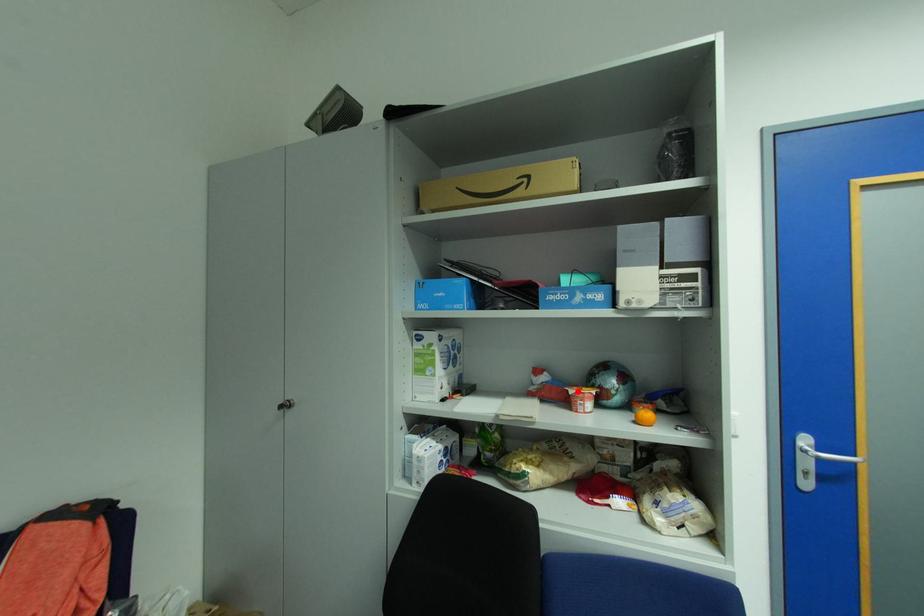
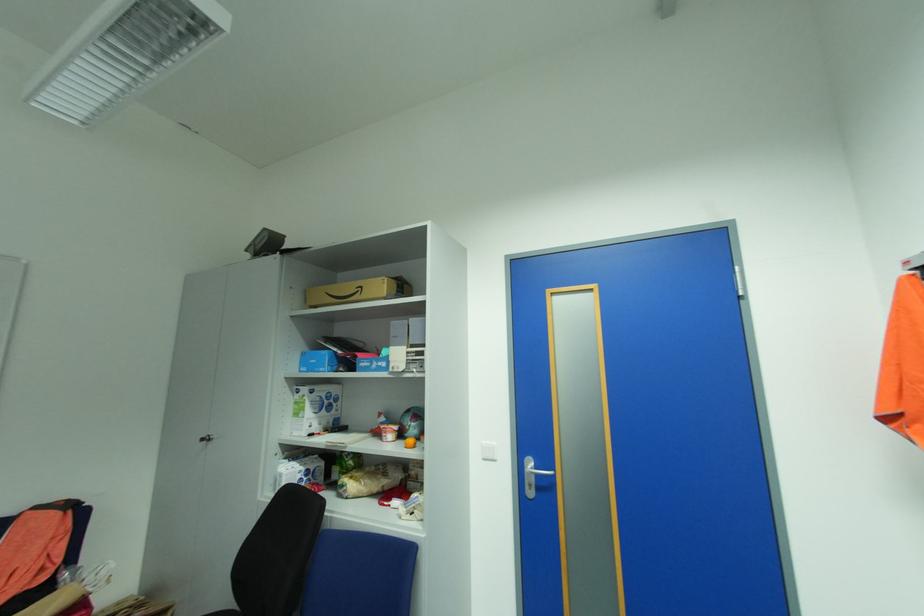
In the second image, find the point that corresponds to the highlighted location in the first image.

(388, 427)